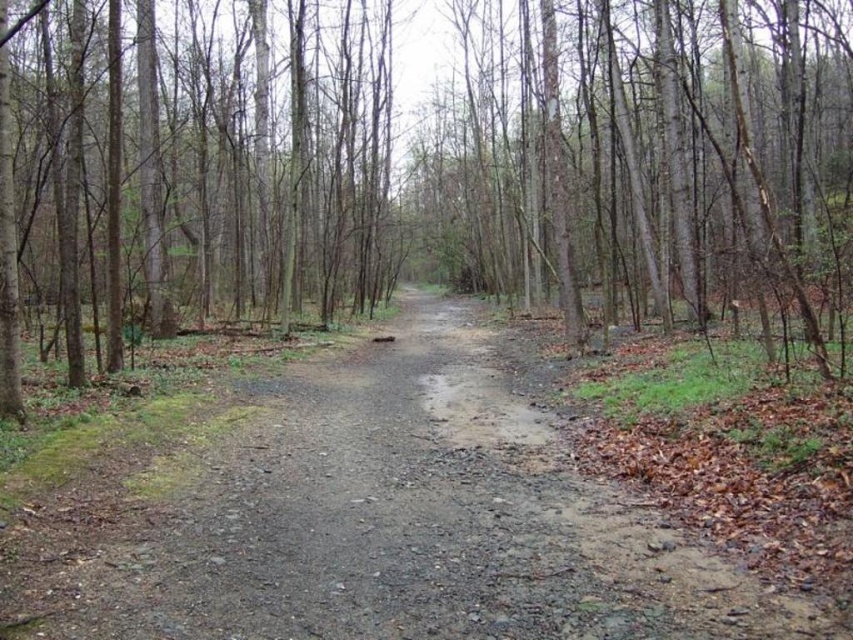
Who is more distant from viewer, (15, 376) or (83, 500)?

The point (15, 376) is behind.

Between point (531, 1) and point (22, 509), which one is positioned in front?

Point (22, 509) is more forward.

The image size is (853, 640). I want to click on brown bark tree at center, so click(x=422, y=168).